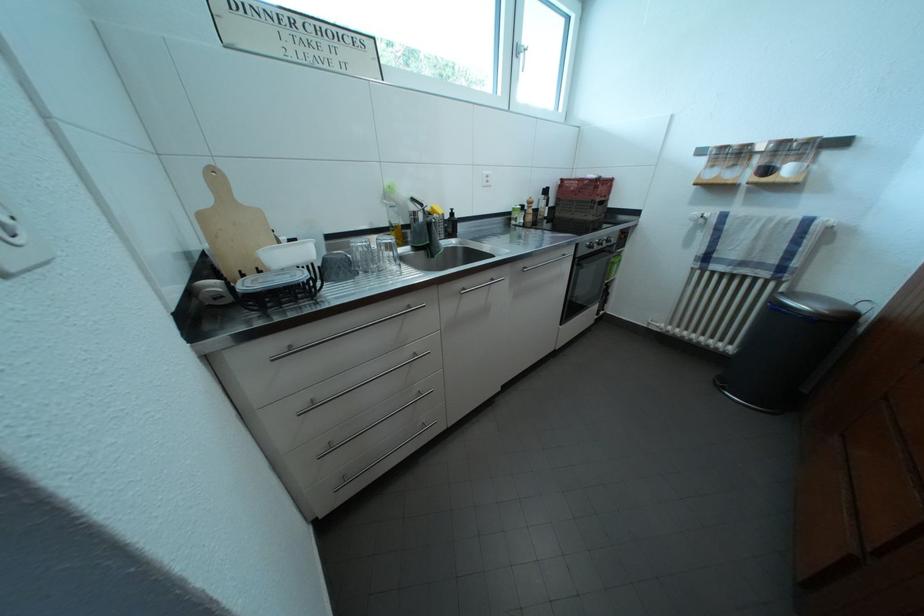
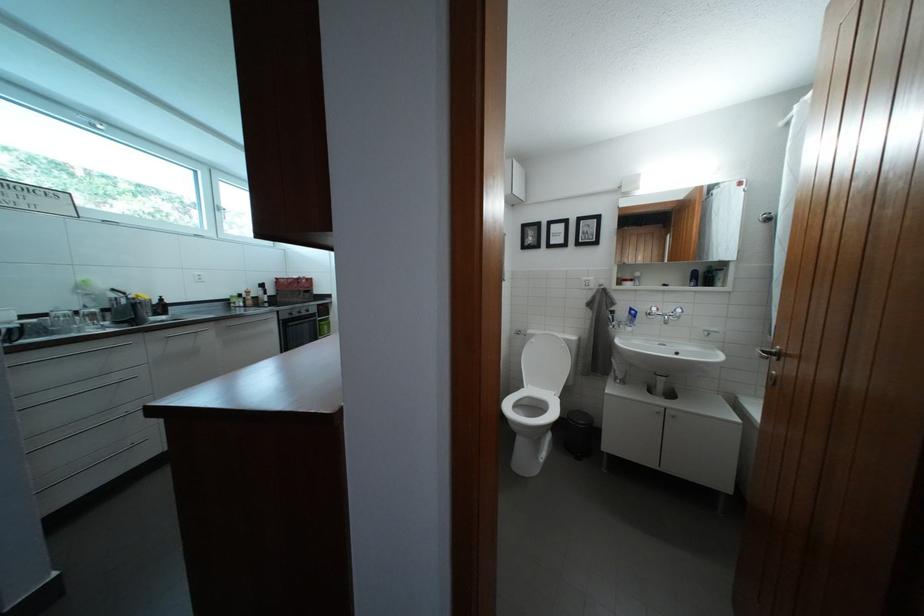
Locate, in the second image, the point that corresponds to pixel 456 223 in the first image.

(165, 307)